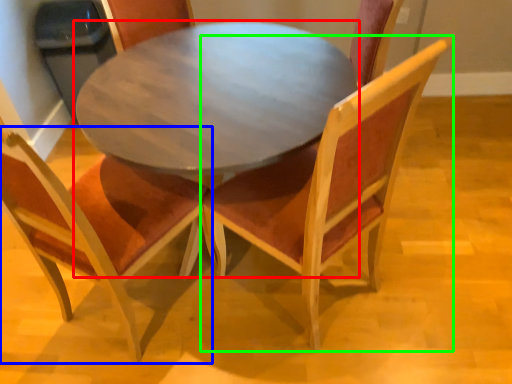
Question: Considering the real-world distances, which object is farthest from coffee table (highlighted by a red box)? chair (highlighted by a blue box) or chair (highlighted by a green box)?

Choices:
 (A) chair
 (B) chair

Answer: (A)